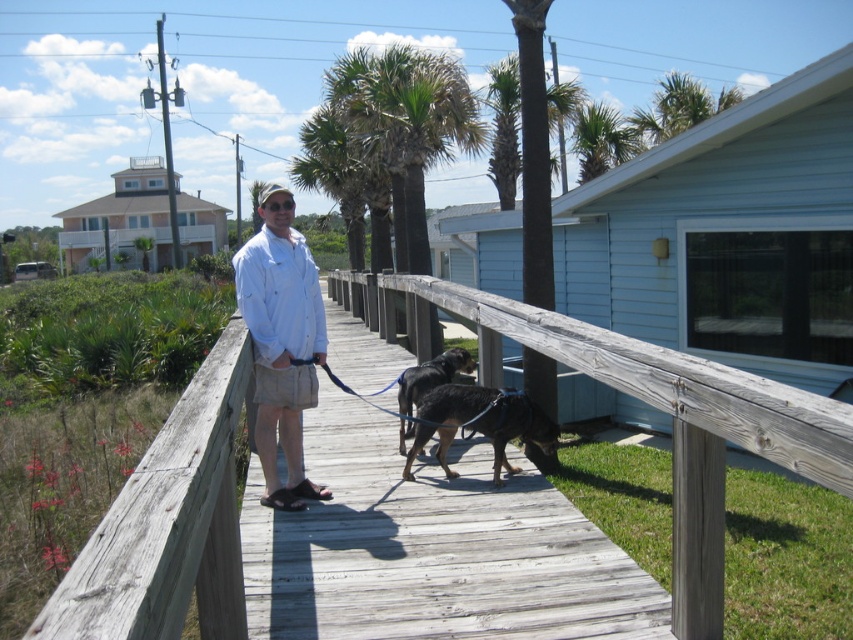
Question: Observing the image, what is the correct spatial positioning of white cotton shirt at center in reference to black suede sandal at lower center?

Choices:
 (A) right
 (B) left

Answer: (B)

Question: Which point is farther to the camera?

Choices:
 (A) white cotton shirt at center
 (B) brown leather sandal at center
 (C) shiny black fur at center
 (D) green leafy palm tree at upper center

Answer: (D)

Question: Which object is closer to the camera taking this photo?

Choices:
 (A) shiny black fur at center
 (B) weathered wood rail at center
 (C) white cotton shirt at center
 (D) matte white cap at center

Answer: (B)

Question: Does green leafy palm tree at upper center have a greater width compared to black fur dog at center?

Choices:
 (A) no
 (B) yes

Answer: (B)

Question: Is weathered wood rail at center positioned at the back of white cotton shirt at center?

Choices:
 (A) yes
 (B) no

Answer: (B)

Question: Which object is closer to the camera taking this photo?

Choices:
 (A) weathered wood rail at center
 (B) shiny black fur at center
 (C) matte white cap at center

Answer: (A)